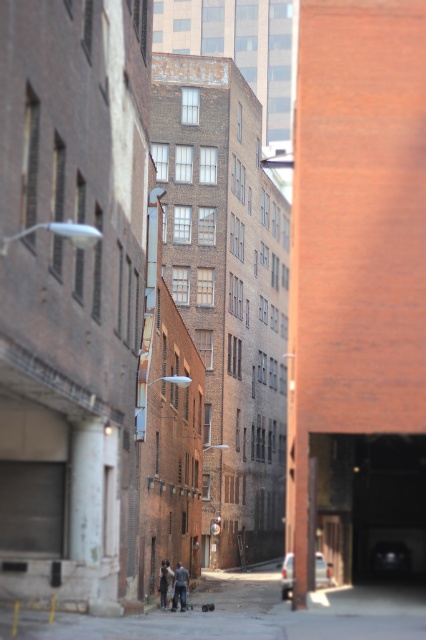
Who is positioned more to the left, concrete sidewalk at center or dark gray jeans at center?

dark gray jeans at center is more to the left.

Who is higher up, concrete sidewalk at center or dark gray jeans at center?

dark gray jeans at center is higher up.

Is point (127, 616) farther from camera compared to point (175, 605)?

That is False.

At what (x,y) coordinates should I click in order to perform the action: click on concrete sidewalk at center. Please return your answer as a coordinate pair (x, y). This screenshot has width=426, height=640. Looking at the image, I should click on (245, 614).

Based on the photo, does concrete sidewalk at center have a lesser height compared to dark gray jacket at lower center?

No, concrete sidewalk at center is not shorter than dark gray jacket at lower center.

From the picture: Is concrete sidewalk at center thinner than dark gray jacket at lower center?

No.

Identify the location of concrete sidewalk at center. (245, 614).

This screenshot has height=640, width=426. What are the coordinates of `concrete sidewalk at center` in the screenshot? It's located at (245, 614).

Is point (175, 602) behind point (161, 589)?

That is False.

Does dark gray jeans at center have a smaller size compared to dark gray jacket at lower center?

No.

In order to click on dark gray jeans at center in this screenshot , I will do `click(180, 586)`.